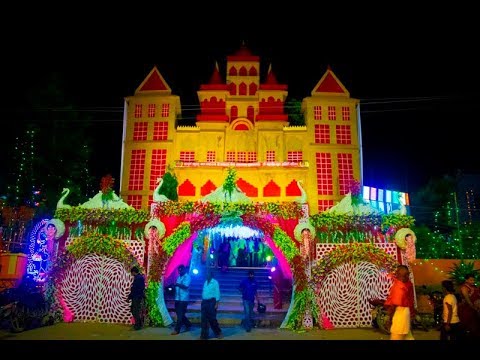
Where is `leds`? leds is located at coordinates (445, 233).